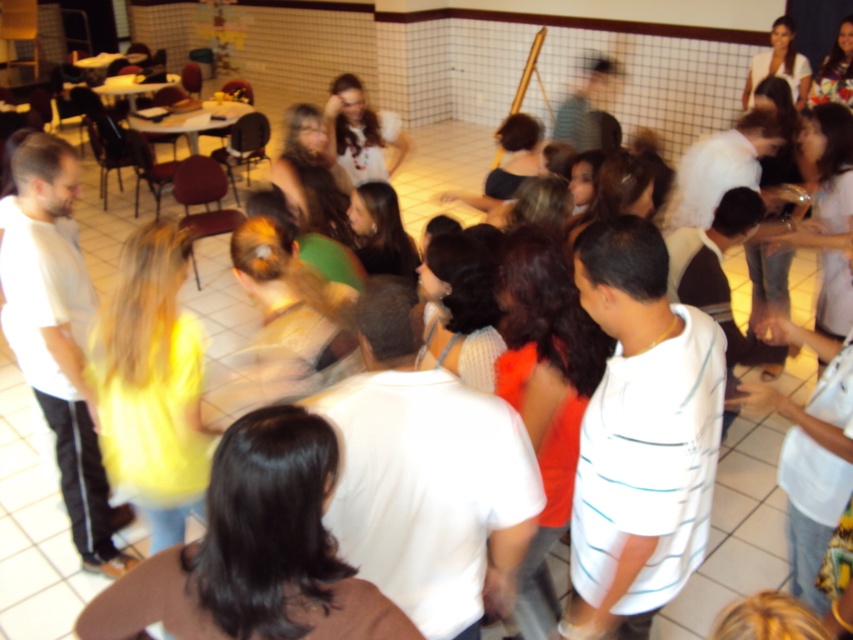
Question: Considering the relative positions of white striped shirt at center and brown hair at center in the image provided, where is white striped shirt at center located with respect to brown hair at center?

Choices:
 (A) left
 (B) right

Answer: (B)

Question: Is white striped shirt at center to the left of brown hair at center from the viewer's perspective?

Choices:
 (A) yes
 (B) no

Answer: (B)

Question: Which point is farther to the camera?

Choices:
 (A) (299, 410)
 (B) (628, 372)

Answer: (B)

Question: Among these objects, which one is farthest from the camera?

Choices:
 (A) white striped shirt at center
 (B) brown hair at center

Answer: (A)

Question: Can you confirm if white striped shirt at center is bigger than brown hair at center?

Choices:
 (A) no
 (B) yes

Answer: (B)

Question: Which point is farther to the camera?

Choices:
 (A) white striped shirt at center
 (B) brown hair at center

Answer: (A)